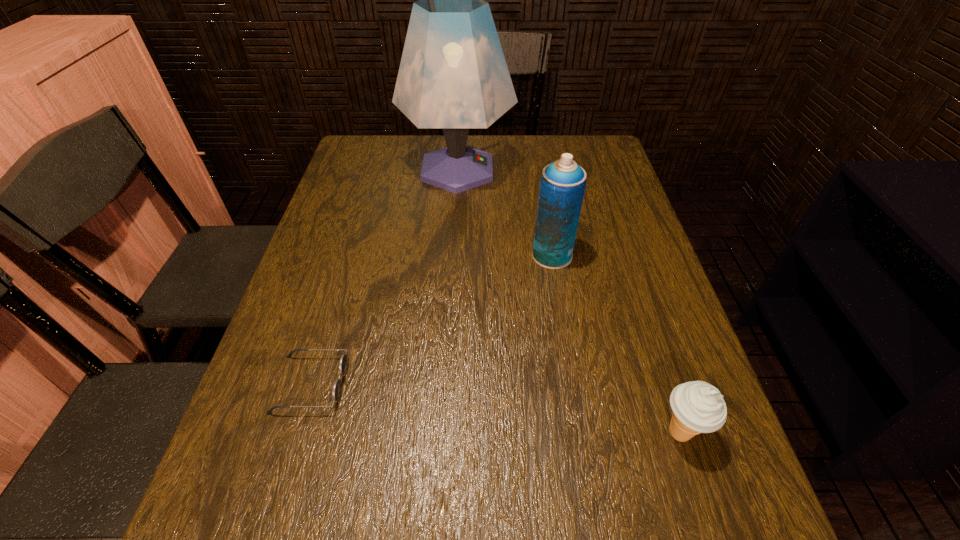
Where is `blank region between the tallest object and the rightmost object`? Image resolution: width=960 pixels, height=540 pixels. blank region between the tallest object and the rightmost object is located at coordinates (568, 302).

Find the location of a particular element. unoccupied area between the second farthest object and the rightmost object is located at coordinates (615, 345).

Where is `free space between the rightmost object and the aerosol can`? The width and height of the screenshot is (960, 540). free space between the rightmost object and the aerosol can is located at coordinates click(x=615, y=345).

Where is `empty space between the tallest object and the icecream`? empty space between the tallest object and the icecream is located at coordinates (568, 302).

This screenshot has width=960, height=540. Find the location of `vacant space that is in between the second shortest object and the lampshade`. vacant space that is in between the second shortest object and the lampshade is located at coordinates (568, 302).

Locate an element on the screen. The height and width of the screenshot is (540, 960). empty space between the icecream and the second farthest object is located at coordinates (615, 345).

Identify the location of vacant area between the third object from right to left and the rightmost object. The height and width of the screenshot is (540, 960). (568, 302).

The width and height of the screenshot is (960, 540). Find the location of `free spot between the shortest object and the rightmost object`. free spot between the shortest object and the rightmost object is located at coordinates (495, 409).

Find the location of a particular element. vacant area that lies between the sunglasses and the third nearest object is located at coordinates (431, 320).

Where is `free spot between the shortest object and the third shortest object`? The width and height of the screenshot is (960, 540). free spot between the shortest object and the third shortest object is located at coordinates (431, 320).